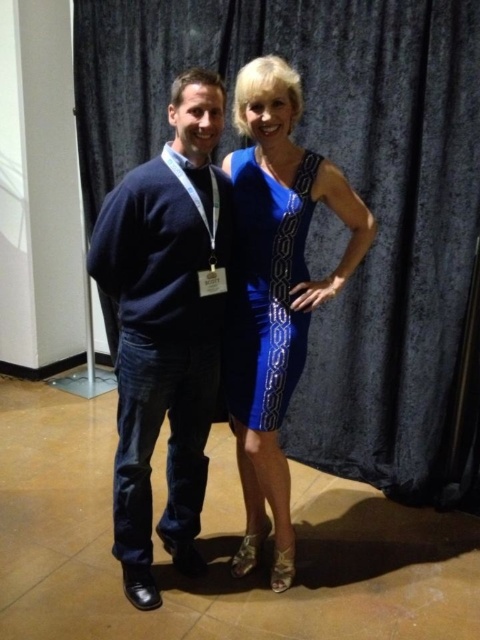
Question: Is dark blue sweater at left closer to camera compared to shiny blue dress at center?

Choices:
 (A) yes
 (B) no

Answer: (A)

Question: Which point appears closest to the camera in this image?

Choices:
 (A) [143, 429]
 (B) [108, 305]
 (C) [249, 340]

Answer: (A)

Question: Which of the following is the farthest from the observer?

Choices:
 (A) (254, 29)
 (B) (271, 416)
 (C) (218, 132)

Answer: (A)

Question: Which object is the closest to the dark blue sweater at left?

Choices:
 (A) blue satin curtain at center
 (B) blue satin dress at center

Answer: (B)

Question: Is the position of blue satin curtain at center less distant than that of dark blue sweater at left?

Choices:
 (A) yes
 (B) no

Answer: (B)

Question: Is dark blue sweater at left to the right of blue satin dress at center from the viewer's perspective?

Choices:
 (A) yes
 (B) no

Answer: (B)